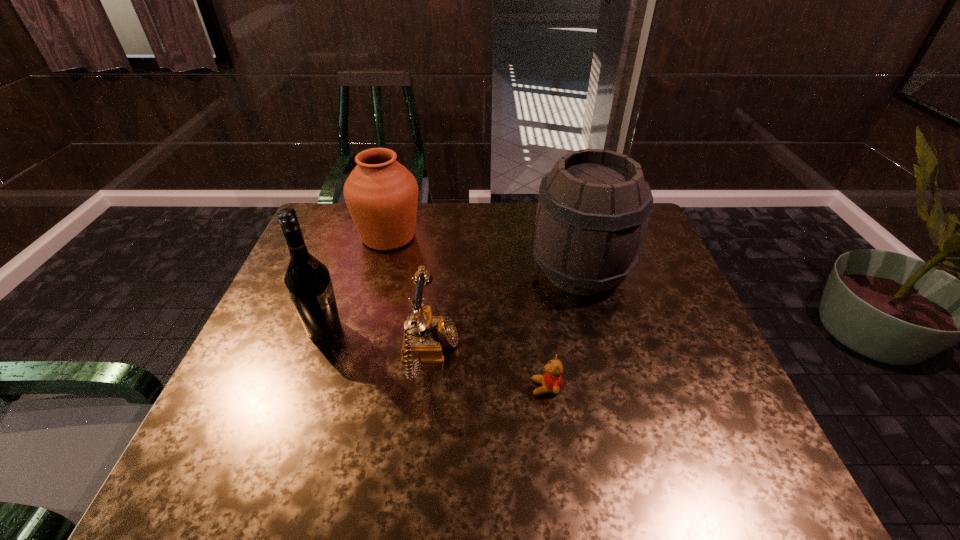
Find the location of a particular element. wine bottle is located at coordinates (308, 282).

Locate an element on the screen. wine bucket is located at coordinates (593, 210).

The height and width of the screenshot is (540, 960). I want to click on urn, so click(x=381, y=194).

Locate an element on the screen. telephone is located at coordinates (425, 336).

What are the coordinates of `the shortest object` in the screenshot? It's located at (552, 380).

You are a GUI agent. You are given a task and a screenshot of the screen. Output one action in this format:
    pyautogui.click(x=<x>, y=<y>)
    Task: Click on the free region located 0.230m on the label of the wine bottle
    The height and width of the screenshot is (540, 960).
    Given the screenshot: What is the action you would take?
    pyautogui.click(x=433, y=328)

At what (x,y) coordinates should I click in order to perform the action: click on free location located on the front of the wine bucket. Please return your answer as a coordinate pair (x, y). Looking at the image, I should click on (595, 329).

This screenshot has width=960, height=540. What are the coordinates of `free space located 0.180m on the front of the urn` in the screenshot? It's located at (372, 298).

I want to click on free space located on the dial number of the telephone, so click(520, 354).

In order to click on vacant space located on the front-facing side of the teddy bear in this screenshot , I will do `click(399, 388)`.